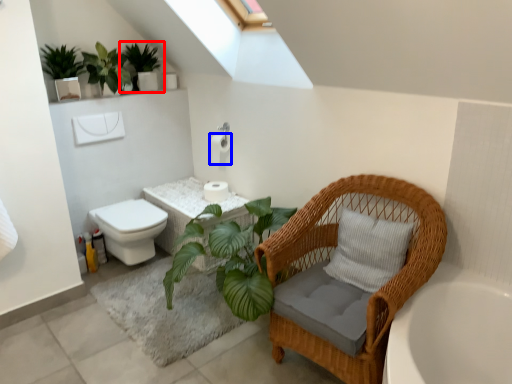
Question: Which object appears closest to the camera in this image, houseplant (highlighted by a red box) or toilet paper (highlighted by a blue box)?

Choices:
 (A) houseplant
 (B) toilet paper

Answer: (A)